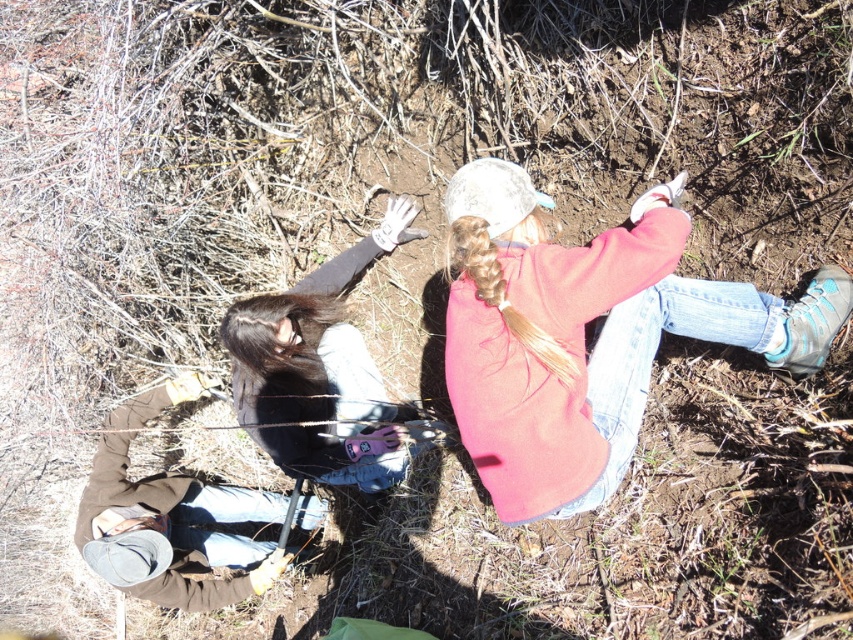
Question: Is dark brown leather jacket at lower left smaller than brown suede jacket at lower left?

Choices:
 (A) no
 (B) yes

Answer: (A)

Question: Among these objects, which one is farthest from the camera?

Choices:
 (A) brown suede jacket at lower left
 (B) dark brown leather jacket at lower left

Answer: (A)

Question: Does pink fleece jacket at center appear on the left side of dark brown leather jacket at lower left?

Choices:
 (A) no
 (B) yes

Answer: (A)

Question: Which object is farther from the camera taking this photo?

Choices:
 (A) pink fleece jacket at center
 (B) dark brown leather jacket at lower left
 (C) brown suede jacket at lower left

Answer: (C)

Question: Can you confirm if dark brown leather jacket at lower left is positioned above brown suede jacket at lower left?

Choices:
 (A) yes
 (B) no

Answer: (A)

Question: Which object is positioned closest to the brown suede jacket at lower left?

Choices:
 (A) pink fleece jacket at center
 (B) dark brown leather jacket at lower left

Answer: (B)